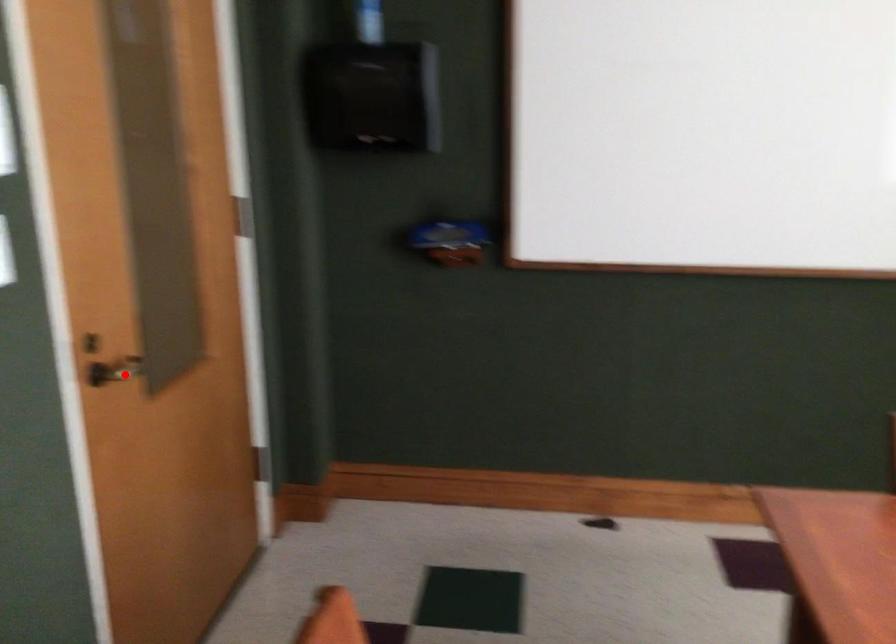
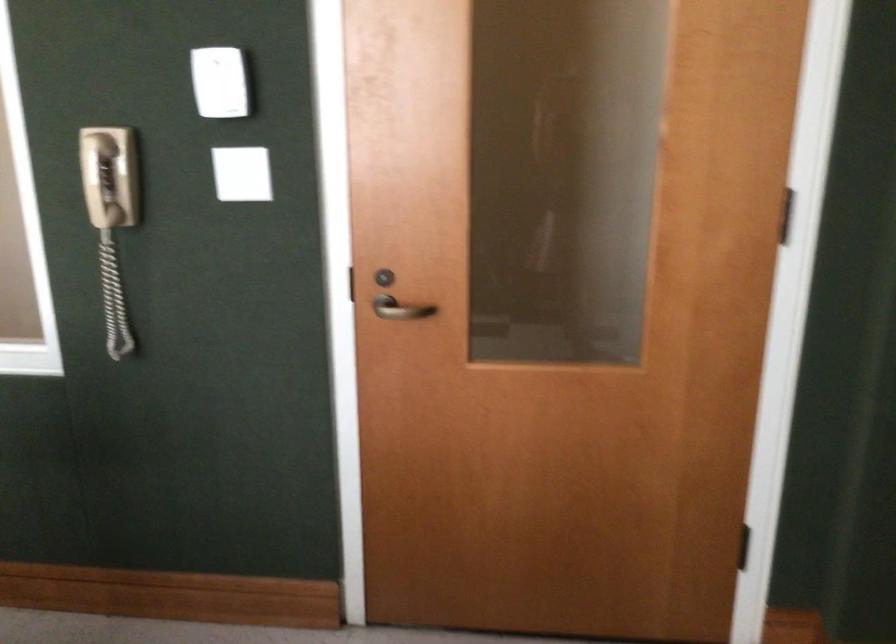
Question: I am providing you with two images of the same scene from different viewpoints. Given a red point in image1, look at the same physical point in image2. Is it:

Choices:
 (A) Closer to the viewpoint
 (B) Farther from the viewpoint

Answer: (B)